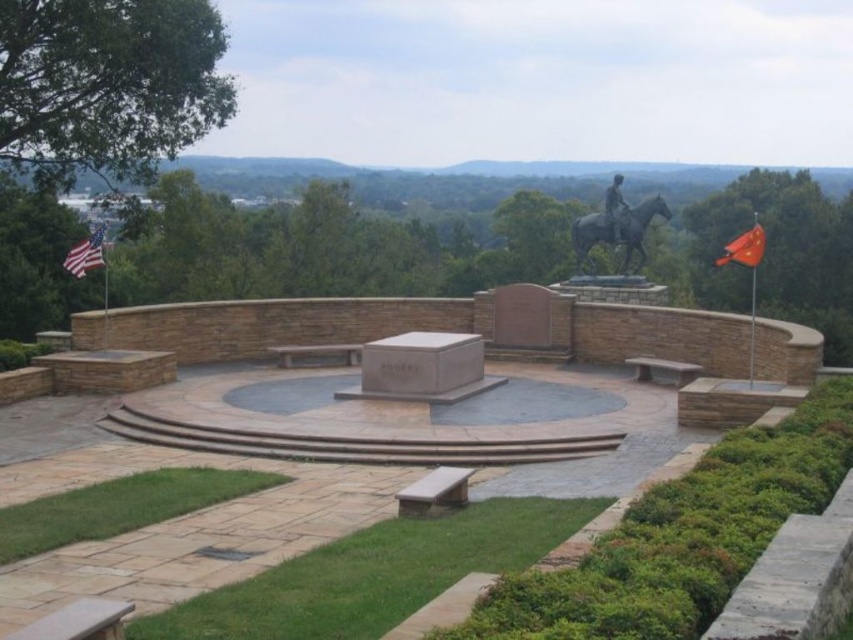
Between red fabric flag at right and polished bronze statue at upper right, which one has less height?

With less height is polished bronze statue at upper right.

Is point (751, 236) farther from camera compared to point (608, 205)?

No, it is not.

You are a GUI agent. You are given a task and a screenshot of the screen. Output one action in this format:
    pyautogui.click(x=<x>, y=<y>)
    Task: Click on the red fabric flag at right
    This screenshot has height=640, width=853.
    Given the screenshot: What is the action you would take?
    pyautogui.click(x=744, y=248)

I want to click on red fabric flag at right, so click(744, 248).

In the scene shown: Can you confirm if brown stone amphitheater at center is taller than bronze statue at center?

Yes.

Does brown stone amphitheater at center appear on the left side of bronze statue at center?

No, brown stone amphitheater at center is not to the left of bronze statue at center.

What do you see at coordinates (421, 326) in the screenshot?
I see `brown stone amphitheater at center` at bounding box center [421, 326].

Identify the location of brown stone amphitheater at center. (421, 326).

Is point (695, 330) positioned in front of point (97, 236)?

No, (695, 330) is behind (97, 236).

Image resolution: width=853 pixels, height=640 pixels. I want to click on brown stone amphitheater at center, so click(x=421, y=326).